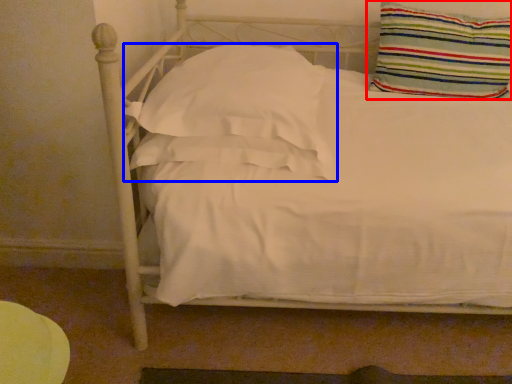
Question: Which object is closer to the camera taking this photo, pillow (highlighted by a red box) or pillow (highlighted by a blue box)?

Choices:
 (A) pillow
 (B) pillow

Answer: (B)